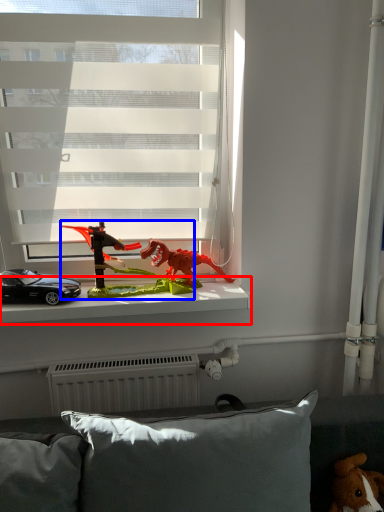
Question: Which point is closer to the camera, window sill (highlighted by a red box) or toy (highlighted by a blue box)?

Choices:
 (A) window sill
 (B) toy

Answer: (B)